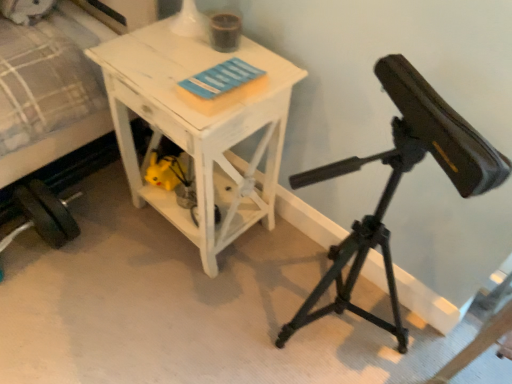
Identify the location of free space above white distressed wood table at center (from a real-world perspective). Image resolution: width=512 pixels, height=384 pixels. [x=189, y=58].